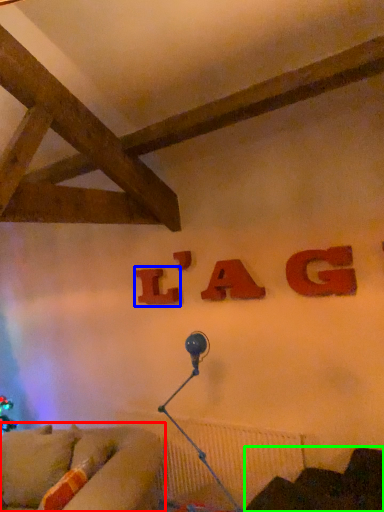
Question: Which is farther away from studio couch (highlighted by a red box)? alphabet (highlighted by a blue box) or furniture (highlighted by a green box)?

Choices:
 (A) alphabet
 (B) furniture

Answer: (A)